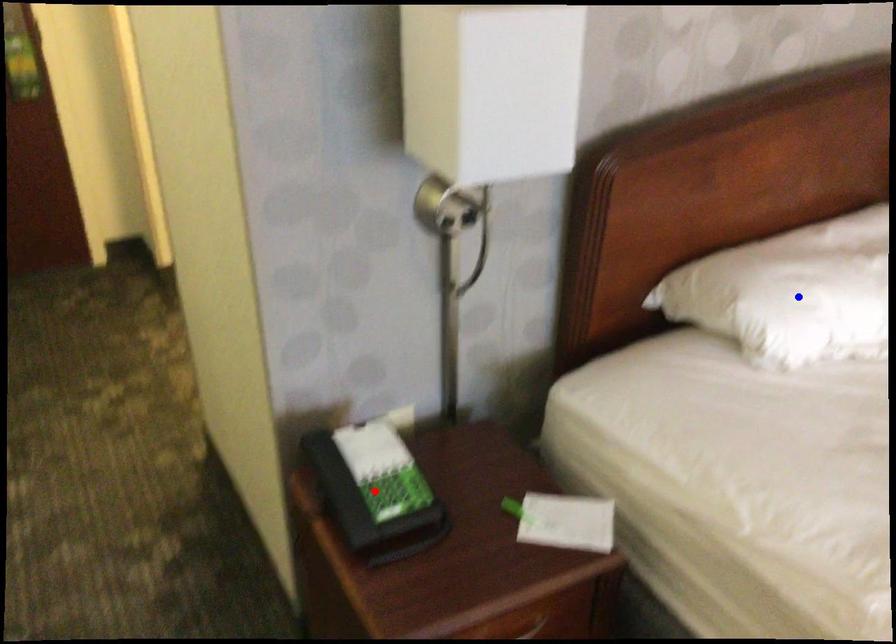
Question: Which of the two points in the image is closer to the camera?

Choices:
 (A) Blue point is closer.
 (B) Red point is closer.

Answer: (B)